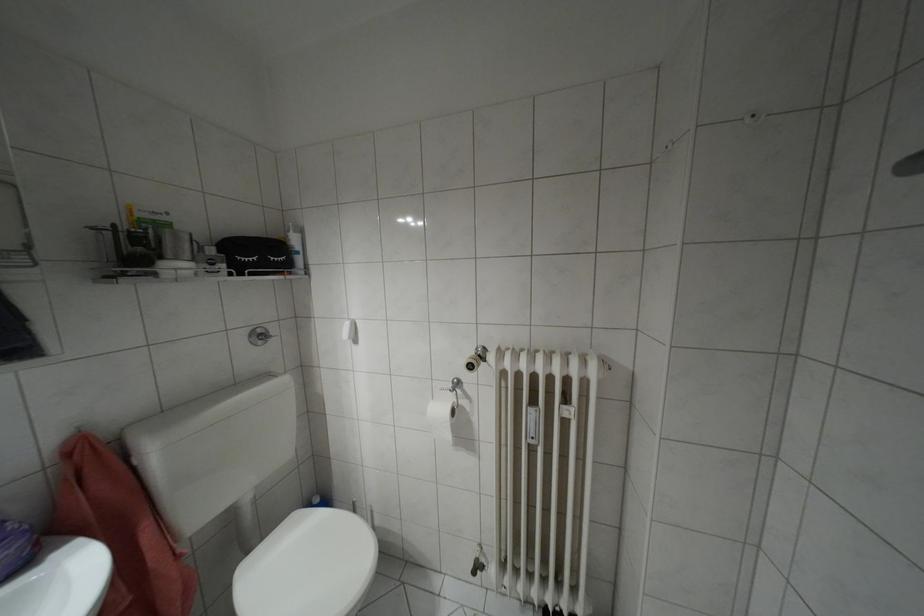
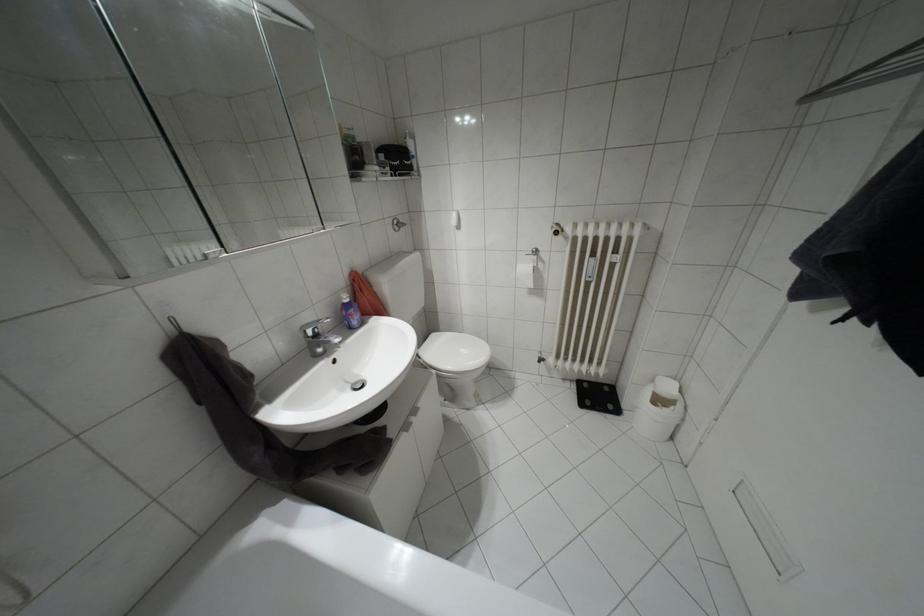
Locate, in the second image, the point that corresponds to point 448,436 in the first image.

(530, 284)